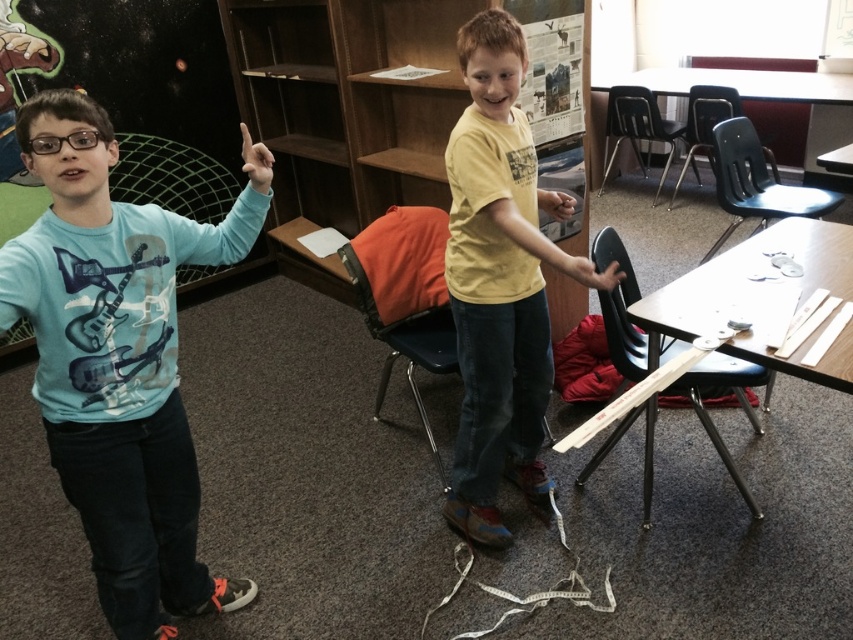
You are a teacher observing the classroom scene. You notice the matte blue shirt at left and the matte skin hand at upper center. Which object is positioned higher in the image?

The matte skin hand at upper center is positioned higher than the matte blue shirt at left.

You are a tailor measuring two items in a classroom scene. The items are the yellow matte shirt at center and the matte yellow hand at center. Which item is wider?

The yellow matte shirt at center is wider than the matte yellow hand at center according to the description provided.

You are a robot measuring the space between two hands in a classroom. The smooth skin hand at center belongs to a boy pointing upwards, and the matte skin hand at upper center is part of a game. Can you determine if a 12 inch ruler can fit between them horizontally?

The distance between the smooth skin hand at center and the matte skin hand at upper center is 33.64 inches, so a 12 inch ruler can fit between them horizontally since it is shorter than the space available.